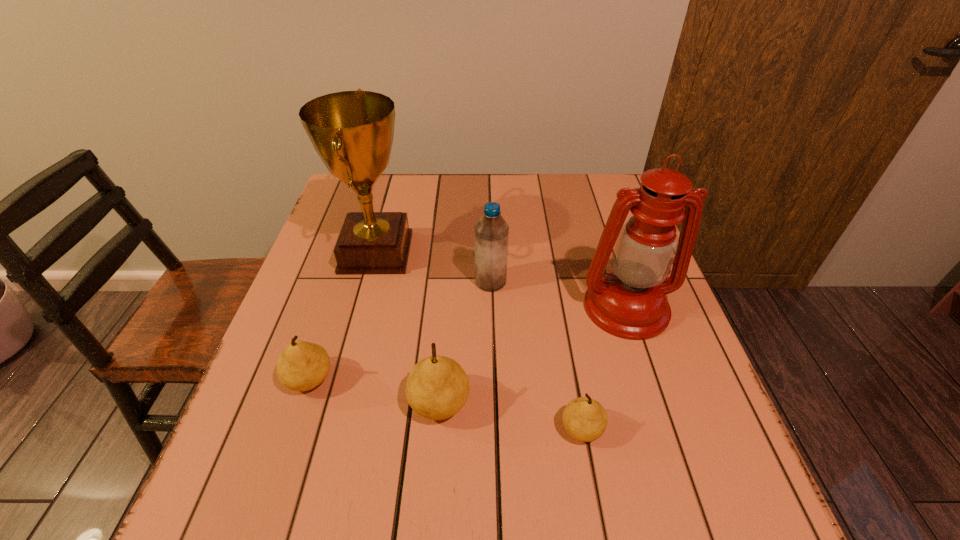
Find the location of a particular element. The height and width of the screenshot is (540, 960). vacant area that satisfies the following two spatial constraints: 1. on the plaque of the award; 2. on the left side of the oil lamp is located at coordinates (362, 307).